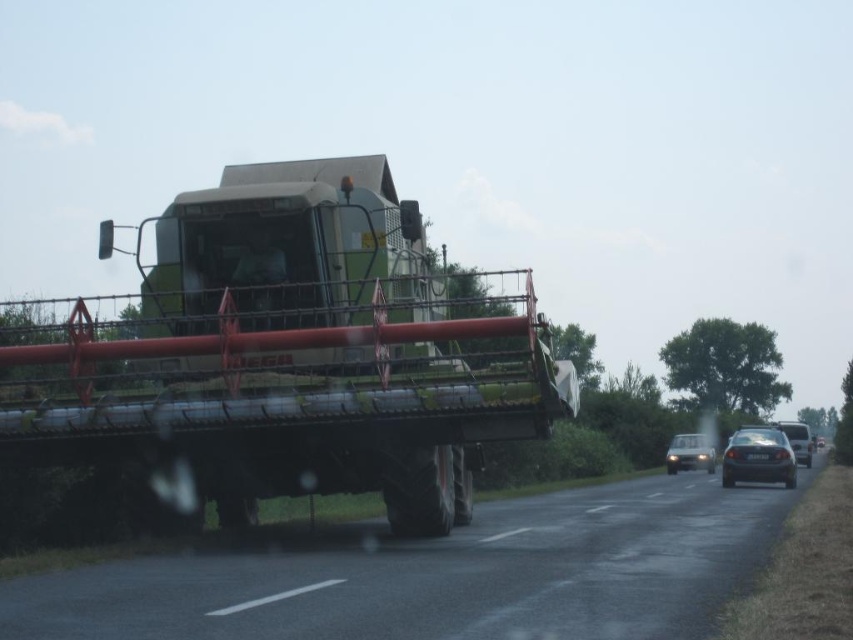
Can you confirm if shiny black sedan at right is thinner than shiny silver sedan at right?

Indeed, shiny black sedan at right has a lesser width compared to shiny silver sedan at right.

Can you confirm if shiny black sedan at right is positioned below shiny silver sedan at right?

No.

Between point (775, 436) and point (784, 422), which one is positioned in front?

Point (775, 436) is more forward.

Where is `shiny black sedan at right`? shiny black sedan at right is located at coordinates (758, 458).

Who is higher up, black asphalt road at center or shiny black sedan at right?

black asphalt road at center is above.

Is black asphalt road at center to the left of shiny black sedan at right from the viewer's perspective?

Yes, black asphalt road at center is to the left of shiny black sedan at right.

The height and width of the screenshot is (640, 853). Describe the element at coordinates (442, 573) in the screenshot. I see `black asphalt road at center` at that location.

Identify the location of black asphalt road at center. The image size is (853, 640). (442, 573).

Does black asphalt road at center lie in front of shiny silver sedan at right?

That is True.

Can you confirm if black asphalt road at center is positioned above shiny silver sedan at right?

Indeed, black asphalt road at center is positioned over shiny silver sedan at right.

You are a GUI agent. You are given a task and a screenshot of the screen. Output one action in this format:
    pyautogui.click(x=<x>, y=<y>)
    Task: Click on the black asphalt road at center
    
    Given the screenshot: What is the action you would take?
    pyautogui.click(x=442, y=573)

Where is `black asphalt road at center`? black asphalt road at center is located at coordinates (442, 573).